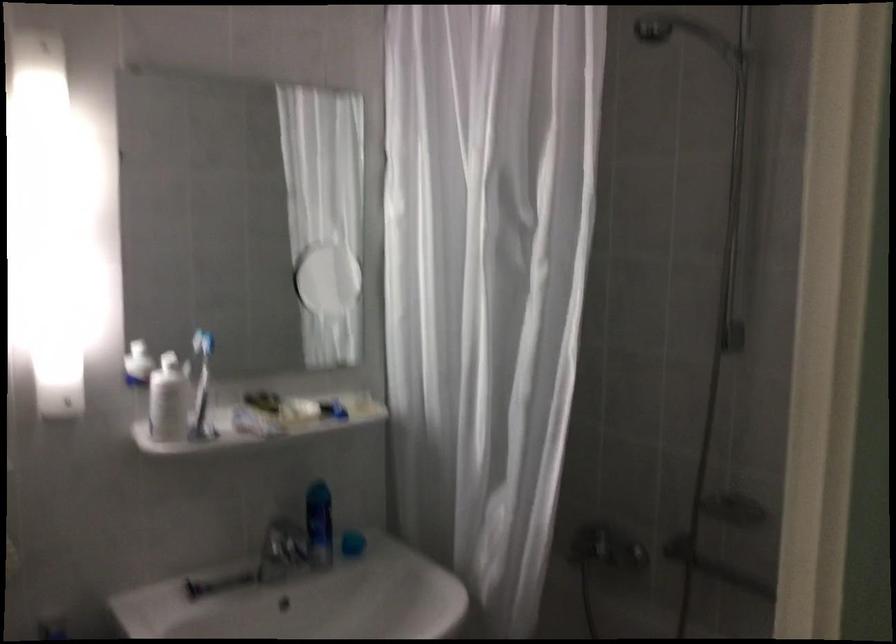
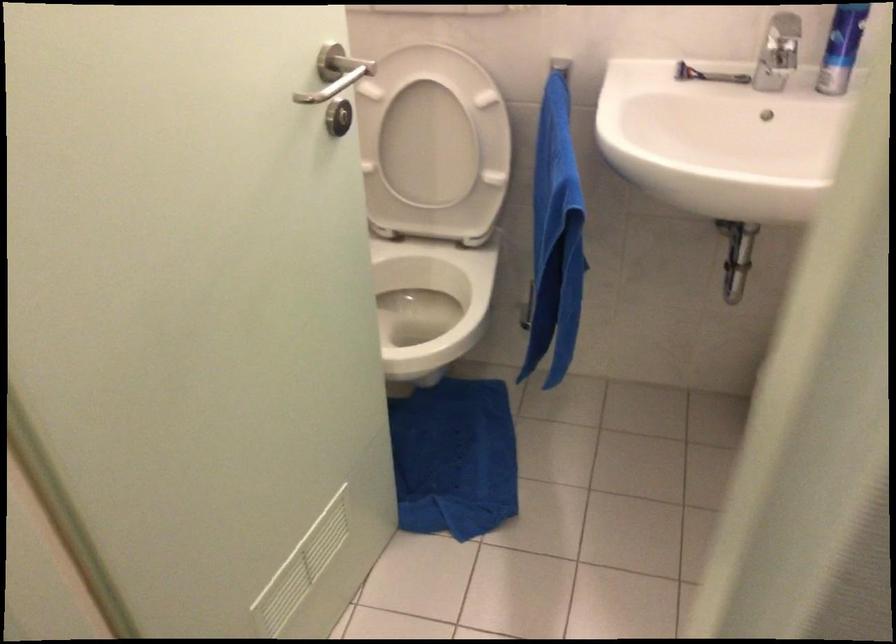
First-person continuous shooting, in which direction is the camera rotating?

The camera's rotation is toward left-down.